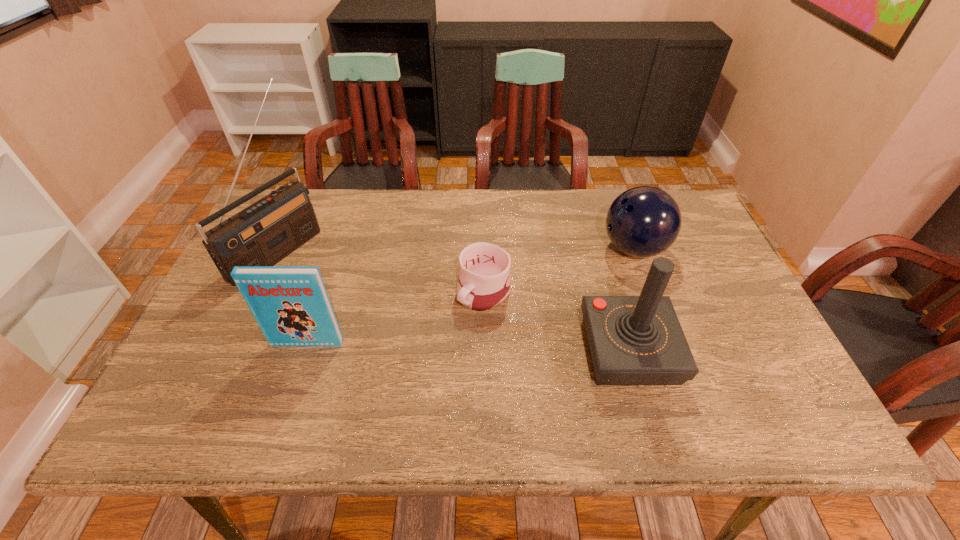
Identify the location of free space that is in between the shortest object and the bowling ball. (559, 271).

The image size is (960, 540). In order to click on empty space that is in between the tallest object and the bowling ball in this screenshot , I will do `click(456, 249)`.

Locate an element on the screen. free area in between the bowling ball and the shortest object is located at coordinates (559, 271).

Identify the location of free space between the tallest object and the joystick. The image size is (960, 540). (453, 300).

The height and width of the screenshot is (540, 960). I want to click on vacant area between the bowling ball and the radio receiver, so click(456, 249).

Find the location of a particular element. Image resolution: width=960 pixels, height=540 pixels. object that is the second closest to the joystick is located at coordinates (484, 281).

Identify which object is the second nearest to the fourth tallest object. Please provide its 2D coordinates. Your answer should be formatted as a tuple, i.e. [(x, y)], where the tuple contains the x and y coordinates of a point satisfying the conditions above.

[(484, 281)]

Locate an element on the screen. The width and height of the screenshot is (960, 540). free space that satisfies the following two spatial constraints: 1. on the back side of the shortest object; 2. on the left side of the bowling ball is located at coordinates (484, 248).

Image resolution: width=960 pixels, height=540 pixels. Identify the location of free location that satisfies the following two spatial constraints: 1. on the back side of the radio receiver; 2. on the left side of the bowling ball. (278, 248).